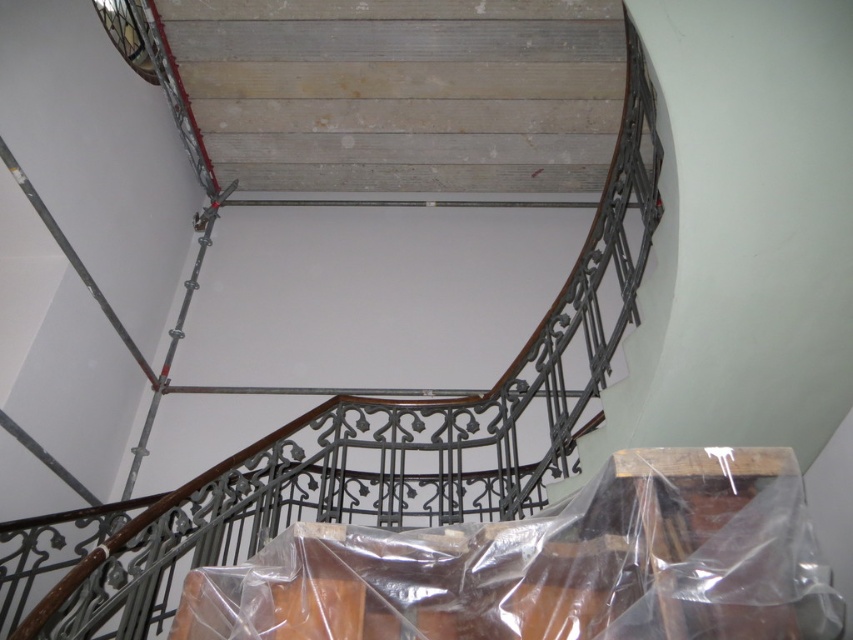
Identify the location of wooden stairs at upper center. (405, 92).

What are the coordinates of `wooden stairs at upper center` in the screenshot? It's located at (405, 92).